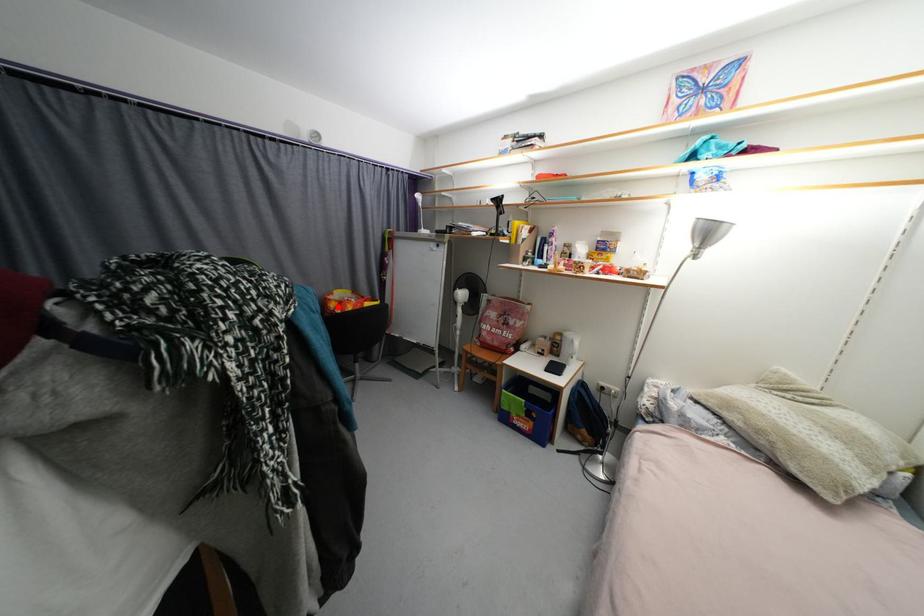
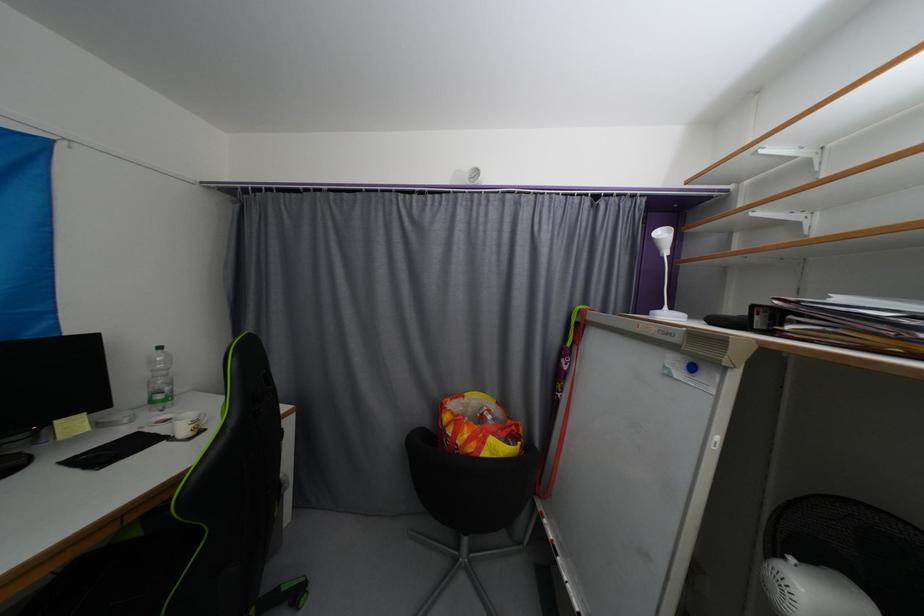
In the second image, find the point that corresponds to the highlighted location in the first image.

(452, 419)